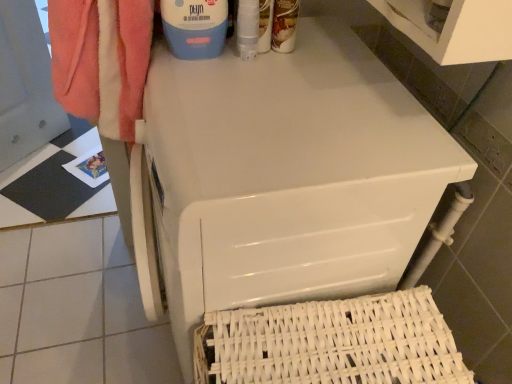
Image resolution: width=512 pixels, height=384 pixels. Describe the element at coordinates (284, 25) in the screenshot. I see `matte brown bottle at upper center, the second cleaning product viewed from the left` at that location.

Measure the distance between white woven basket at lower right and camera.

white woven basket at lower right and camera are 27.56 inches apart from each other.

The width and height of the screenshot is (512, 384). In order to click on matte brown bottle at upper center, the 1th cleaning product positioned from the right in this screenshot , I will do `click(284, 25)`.

Consider the image. Which of these two, blue plastic container at upper center, acting as the 2th cleaning product starting from the right, or white glossy washing machine at upper center, stands taller?

white glossy washing machine at upper center is taller.

Can you tell me how much blue plastic container at upper center, which is counted as the 1th cleaning product, starting from the left, and white glossy washing machine at upper center differ in facing direction?

85.4 degrees.

Does point (174, 0) come in front of point (245, 207)?

No, it is behind (245, 207).

Is matte brown bottle at upper center, the second cleaning product viewed from the left, at the back of white woven basket at lower right?

No, matte brown bottle at upper center, the second cleaning product viewed from the left, is not at the back of white woven basket at lower right.

Looking at this image, who is taller, white woven basket at lower right or matte brown bottle at upper center, the 1th cleaning product positioned from the right?

With more height is white woven basket at lower right.

Does white woven basket at lower right appear on the left side of matte brown bottle at upper center, the second cleaning product viewed from the left?

No, white woven basket at lower right is not to the left of matte brown bottle at upper center, the second cleaning product viewed from the left.

From the white woven basket at lower right, count the 1st cleaning product to the left and point to it. Please provide its 2D coordinates.

[(284, 25)]

The height and width of the screenshot is (384, 512). I want to click on home appliance above the white woven basket at lower right (from a real-world perspective), so click(292, 215).

From a real-world perspective, which object rests below the other?

white woven basket at lower right, from a real-world perspective.

Based on the photo, is white glossy washing machine at upper center closer to camera compared to white woven basket at lower right?

Yes, the depth of white glossy washing machine at upper center is less than that of white woven basket at lower right.

Considering the relative positions of white glossy washing machine at upper center and white woven basket at lower right in the image provided, is white glossy washing machine at upper center to the left or to the right of white woven basket at lower right?

Based on their positions, white glossy washing machine at upper center is located to the left of white woven basket at lower right.

How different are the orientations of matte brown bottle at upper center, the 1th cleaning product positioned from the right, and blue plastic container at upper center, which is counted as the 1th cleaning product, starting from the left, in degrees?

matte brown bottle at upper center, the 1th cleaning product positioned from the right, and blue plastic container at upper center, which is counted as the 1th cleaning product, starting from the left, are facing 3.9 degrees away from each other.

Between matte brown bottle at upper center, the 1th cleaning product positioned from the right, and blue plastic container at upper center, acting as the 2th cleaning product starting from the right, which one has more height?

With more height is blue plastic container at upper center, acting as the 2th cleaning product starting from the right.

Which is correct: matte brown bottle at upper center, the second cleaning product viewed from the left, is inside blue plastic container at upper center, which is counted as the 1th cleaning product, starting from the left, or outside of it?

matte brown bottle at upper center, the second cleaning product viewed from the left, is not enclosed by blue plastic container at upper center, which is counted as the 1th cleaning product, starting from the left.

Does point (288, 20) lie behind point (218, 39)?

That is True.

Based on the photo, considering the positions of objects white glossy washing machine at upper center and matte brown bottle at upper center, the 1th cleaning product positioned from the right, in the image provided, who is behind, white glossy washing machine at upper center or matte brown bottle at upper center, the 1th cleaning product positioned from the right,?

matte brown bottle at upper center, the 1th cleaning product positioned from the right, is further from the camera.

Is point (338, 274) closer or farther from the camera than point (288, 23)?

Clearly, point (338, 274) is closer to the camera than point (288, 23).

From a real-world perspective, which is physically below, white glossy washing machine at upper center or matte brown bottle at upper center, the 1th cleaning product positioned from the right?

white glossy washing machine at upper center is physically lower.

Based on the photo, considering the sizes of objects matte brown bottle at upper center, the 1th cleaning product positioned from the right, and white glossy washing machine at upper center in the image provided, who is shorter, matte brown bottle at upper center, the 1th cleaning product positioned from the right, or white glossy washing machine at upper center?

Standing shorter between the two is matte brown bottle at upper center, the 1th cleaning product positioned from the right.

Is matte brown bottle at upper center, the 1th cleaning product positioned from the right, positioned behind white glossy washing machine at upper center?

That is True.

Is matte brown bottle at upper center, the second cleaning product viewed from the left, oriented towards white glossy washing machine at upper center?

No, matte brown bottle at upper center, the second cleaning product viewed from the left, is not aimed at white glossy washing machine at upper center.

Considering the sizes of matte brown bottle at upper center, the 1th cleaning product positioned from the right, and white glossy washing machine at upper center in the image, is matte brown bottle at upper center, the 1th cleaning product positioned from the right, wider or thinner than white glossy washing machine at upper center?

In the image, matte brown bottle at upper center, the 1th cleaning product positioned from the right, appears to be more narrow than white glossy washing machine at upper center.

Is white glossy washing machine at upper center far from blue plastic container at upper center, which is counted as the 1th cleaning product, starting from the left?

No, white glossy washing machine at upper center is in close proximity to blue plastic container at upper center, which is counted as the 1th cleaning product, starting from the left.

Consider the image. From the image's perspective, would you say white glossy washing machine at upper center is shown under blue plastic container at upper center, acting as the 2th cleaning product starting from the right?

Indeed, from the image's perspective, white glossy washing machine at upper center is shown beneath blue plastic container at upper center, acting as the 2th cleaning product starting from the right.

Which is in front, white glossy washing machine at upper center or blue plastic container at upper center, which is counted as the 1th cleaning product, starting from the left?

white glossy washing machine at upper center is closer to the camera.

At what (x,y) coordinates should I click in order to perform the action: click on home appliance in front of the blue plastic container at upper center, which is counted as the 1th cleaning product, starting from the left. Please return your answer as a coordinate pair (x, y). The width and height of the screenshot is (512, 384). Looking at the image, I should click on (292, 215).

The width and height of the screenshot is (512, 384). In order to click on the 1st cleaning product to the left when counting from the white woven basket at lower right in this screenshot , I will do `click(284, 25)`.

Which object lies nearer to the anchor point white woven basket at lower right, matte brown bottle at upper center, the 1th cleaning product positioned from the right, or blue plastic container at upper center, acting as the 2th cleaning product starting from the right?

Among the two, blue plastic container at upper center, acting as the 2th cleaning product starting from the right, is located nearer to white woven basket at lower right.

Which object lies nearer to the anchor point white glossy washing machine at upper center, blue plastic container at upper center, which is counted as the 1th cleaning product, starting from the left, or matte brown bottle at upper center, the 1th cleaning product positioned from the right?

The object closer to white glossy washing machine at upper center is blue plastic container at upper center, which is counted as the 1th cleaning product, starting from the left.

When comparing their distances from matte brown bottle at upper center, the second cleaning product viewed from the left, does white glossy washing machine at upper center or white woven basket at lower right seem closer?

white glossy washing machine at upper center is positioned closer to the anchor matte brown bottle at upper center, the second cleaning product viewed from the left.

Consider the image. Looking at the image, which one is located closer to matte brown bottle at upper center, the 1th cleaning product positioned from the right, blue plastic container at upper center, which is counted as the 1th cleaning product, starting from the left, or white woven basket at lower right?

blue plastic container at upper center, which is counted as the 1th cleaning product, starting from the left, is closer to matte brown bottle at upper center, the 1th cleaning product positioned from the right.

Based on their spatial positions, is white woven basket at lower right or blue plastic container at upper center, which is counted as the 1th cleaning product, starting from the left, further from white glossy washing machine at upper center?

The object further to white glossy washing machine at upper center is blue plastic container at upper center, which is counted as the 1th cleaning product, starting from the left.

Estimate the real-world distances between objects in this image. Which object is further from white glossy washing machine at upper center, white woven basket at lower right or matte brown bottle at upper center, the second cleaning product viewed from the left?

Based on the image, matte brown bottle at upper center, the second cleaning product viewed from the left, appears to be further to white glossy washing machine at upper center.

From the image, which object appears to be nearer to white woven basket at lower right, blue plastic container at upper center, which is counted as the 1th cleaning product, starting from the left, or white glossy washing machine at upper center?

white glossy washing machine at upper center is closer to white woven basket at lower right.

From the image, which object appears to be farther from matte brown bottle at upper center, the 1th cleaning product positioned from the right, white woven basket at lower right or blue plastic container at upper center, which is counted as the 1th cleaning product, starting from the left?

white woven basket at lower right is positioned further to the anchor matte brown bottle at upper center, the 1th cleaning product positioned from the right.

Where is `home appliance between blue plastic container at upper center, which is counted as the 1th cleaning product, starting from the left, and white woven basket at lower right vertically`? The image size is (512, 384). home appliance between blue plastic container at upper center, which is counted as the 1th cleaning product, starting from the left, and white woven basket at lower right vertically is located at coordinates (292, 215).

Locate an element on the screen. Image resolution: width=512 pixels, height=384 pixels. cleaning product between blue plastic container at upper center, which is counted as the 1th cleaning product, starting from the left, and white woven basket at lower right in the up-down direction is located at coordinates (284, 25).

This screenshot has height=384, width=512. Identify the location of cleaning product between blue plastic container at upper center, acting as the 2th cleaning product starting from the right, and white glossy washing machine at upper center vertically. (284, 25).

I want to click on home appliance between matte brown bottle at upper center, the 1th cleaning product positioned from the right, and white woven basket at lower right in the up-down direction, so click(x=292, y=215).